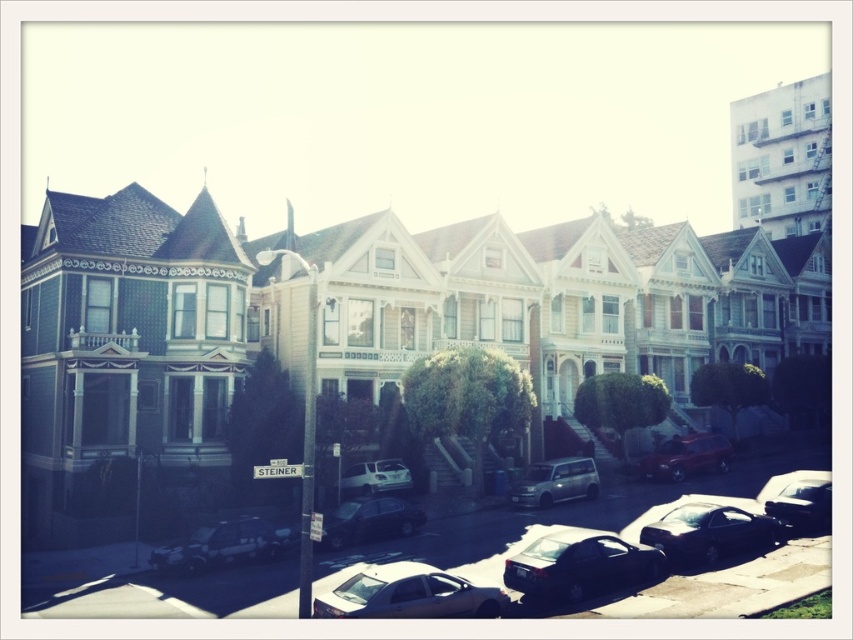
Who is more forward, (786,508) or (372,472)?

Point (786,508) is in front.

Can you confirm if shiny silver car at lower right is thinner than white matte car at center?

No, shiny silver car at lower right is not thinner than white matte car at center.

The image size is (853, 640). Identify the location of shiny silver car at lower right. (799, 499).

The width and height of the screenshot is (853, 640). In order to click on shiny silver car at lower right in this screenshot , I will do `click(799, 499)`.

Can you confirm if metallic silver sedan at lower left is thinner than shiny red suv at center?

No.

Can you confirm if metallic silver sedan at lower left is positioned above shiny red suv at center?

Incorrect, metallic silver sedan at lower left is not positioned above shiny red suv at center.

Find the location of a particular element. metallic silver sedan at lower left is located at coordinates (224, 545).

Can you confirm if shiny silver car at lower right is taller than satin silver van at center?

In fact, shiny silver car at lower right may be shorter than satin silver van at center.

Does shiny silver car at lower right have a greater width compared to satin silver van at center?

Correct, the width of shiny silver car at lower right exceeds that of satin silver van at center.

At what (x,y) coordinates should I click in order to perform the action: click on shiny silver car at lower right. Please return your answer as a coordinate pair (x, y). This screenshot has width=853, height=640. Looking at the image, I should click on (799, 499).

In order to click on shiny silver car at lower right in this screenshot , I will do `click(799, 499)`.